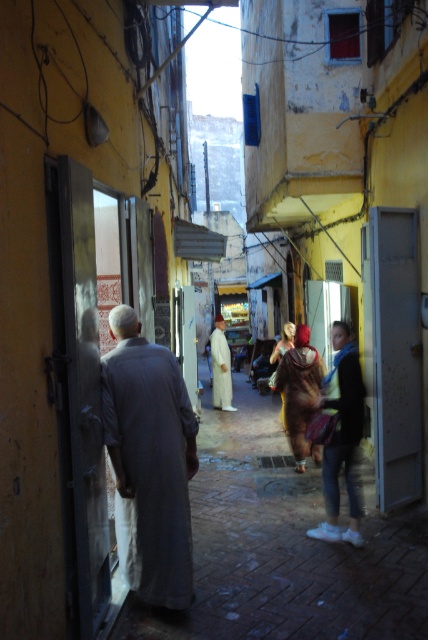
Question: Which of these objects is positioned closest to the denim jeans at center?

Choices:
 (A) white cotton robe at center
 (B) gray cotton robe at left

Answer: (B)

Question: Where is gray cotton robe at left located in relation to white cotton robe at center in the image?

Choices:
 (A) left
 (B) right

Answer: (A)

Question: Is gray cotton robe at left behind white cotton robe at center?

Choices:
 (A) no
 (B) yes

Answer: (A)

Question: Based on their relative distances, which object is farther from the denim jeans at center?

Choices:
 (A) white cotton robe at center
 (B) gray cotton robe at left

Answer: (A)

Question: Does denim jeans at center lie in front of white cotton robe at center?

Choices:
 (A) yes
 (B) no

Answer: (A)

Question: Which is nearer to the denim jeans at center?

Choices:
 (A) gray cotton robe at left
 (B) white cotton robe at center

Answer: (A)